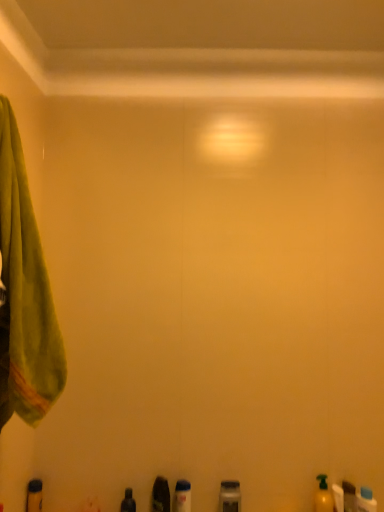
What do you see at coordinates (182, 496) in the screenshot? I see `translucent plastic bottle at lower center, which is the sixth toiletry from right to left` at bounding box center [182, 496].

What is the approximate width of translucent plastic bottle at lower center, which is the third toiletry from left to right?

translucent plastic bottle at lower center, which is the third toiletry from left to right, is 2.88 inches in width.

In order to click on yellow matte bottle at lower right, which appears as the 3th toiletry when viewed from the right in this screenshot , I will do `click(338, 497)`.

The height and width of the screenshot is (512, 384). I want to click on translucent plastic bottle at lower center, which is the third toiletry from left to right, so click(182, 496).

Considering the positions of objects matte black bottle at lower left, the first toiletry positioned from the left, and shiny black bottle at lower center, the 2th toiletry from the left, in the image provided, who is more to the left, matte black bottle at lower left, the first toiletry positioned from the left, or shiny black bottle at lower center, the 2th toiletry from the left,?

From the viewer's perspective, matte black bottle at lower left, the first toiletry positioned from the left, appears more on the left side.

Who is smaller, matte black bottle at lower left, the first toiletry positioned from the left, or shiny black bottle at lower center, the 7th toiletry when ordered from right to left?

With smaller size is shiny black bottle at lower center, the 7th toiletry when ordered from right to left.

What's the angular difference between matte black bottle at lower left, the first toiletry positioned from the left, and shiny black bottle at lower center, the 7th toiletry when ordered from right to left,'s facing directions?

They differ by 0.000881 degrees in their facing directions.

Can yellow matte bottle at lower right, marked as the 6th toiletry in a left-to-right arrangement, be found inside shiny black bottle at lower center, the 7th toiletry when ordered from right to left?

Actually, yellow matte bottle at lower right, marked as the 6th toiletry in a left-to-right arrangement, is outside shiny black bottle at lower center, the 7th toiletry when ordered from right to left.

Between shiny black bottle at lower center, the 7th toiletry when ordered from right to left, and yellow matte bottle at lower right, which appears as the 3th toiletry when viewed from the right, which one has larger width?

With larger width is yellow matte bottle at lower right, which appears as the 3th toiletry when viewed from the right.

Is shiny black bottle at lower center, the 2th toiletry from the left, next to yellow matte bottle at lower right, marked as the 6th toiletry in a left-to-right arrangement?

shiny black bottle at lower center, the 2th toiletry from the left, and yellow matte bottle at lower right, marked as the 6th toiletry in a left-to-right arrangement, are clearly separated.

In terms of size, does shiny black bottle at lower center, the 7th toiletry when ordered from right to left, appear bigger or smaller than yellow matte bottle at lower right, marked as the 6th toiletry in a left-to-right arrangement?

Considering their sizes, shiny black bottle at lower center, the 7th toiletry when ordered from right to left, takes up more space than yellow matte bottle at lower right, marked as the 6th toiletry in a left-to-right arrangement.

From a real-world perspective, relative to green soft towel at left, is metallic gray container at lower center, arranged as the fourth toiletry when viewed from the left, vertically above or below?

metallic gray container at lower center, arranged as the fourth toiletry when viewed from the left, is situated lower than green soft towel at left in the real world.

In the scene shown: Which object is thinner, metallic gray container at lower center, arranged as the fourth toiletry when viewed from the left, or green soft towel at left?

Thinner between the two is metallic gray container at lower center, arranged as the fourth toiletry when viewed from the left.

From the image's perspective, is metallic gray container at lower center, the 5th toiletry in the right-to-left sequence, beneath green soft towel at left?

Yes.

Considering the relative sizes of metallic gray container at lower center, the 5th toiletry in the right-to-left sequence, and green soft towel at left in the image provided, is metallic gray container at lower center, the 5th toiletry in the right-to-left sequence, smaller than green soft towel at left?

Indeed, metallic gray container at lower center, the 5th toiletry in the right-to-left sequence, has a smaller size compared to green soft towel at left.

Does point (224, 495) come farther from viewer compared to point (351, 494)?

No.

Consider the image. Is translucent plastic bottle at lower right, which is the second toiletry from right to left, completely or partially inside metallic gray container at lower center, arranged as the fourth toiletry when viewed from the left?

No, translucent plastic bottle at lower right, which is the second toiletry from right to left, is not surrounded by metallic gray container at lower center, arranged as the fourth toiletry when viewed from the left.

Measure the distance from metallic gray container at lower center, the 5th toiletry in the right-to-left sequence, to translucent plastic bottle at lower right, arranged as the 7th toiletry when viewed from the left.

The distance of metallic gray container at lower center, the 5th toiletry in the right-to-left sequence, from translucent plastic bottle at lower right, arranged as the 7th toiletry when viewed from the left, is 16.17 inches.

From the picture: Who is smaller, metallic gray container at lower center, arranged as the fourth toiletry when viewed from the left, or translucent plastic bottle at lower right, which is the second toiletry from right to left?

With smaller size is translucent plastic bottle at lower right, which is the second toiletry from right to left.

Is green soft towel at left placed right next to metallic gray container at lower center, the 5th toiletry in the right-to-left sequence?

green soft towel at left and metallic gray container at lower center, the 5th toiletry in the right-to-left sequence, are not in contact.

Is green soft towel at left to the right of metallic gray container at lower center, arranged as the fourth toiletry when viewed from the left, from the viewer's perspective?

No, green soft towel at left is not to the right of metallic gray container at lower center, arranged as the fourth toiletry when viewed from the left.

Is green soft towel at left bigger than metallic gray container at lower center, arranged as the fourth toiletry when viewed from the left?

Yes, green soft towel at left is bigger than metallic gray container at lower center, arranged as the fourth toiletry when viewed from the left.

Between yellow matte bottle at lower right, the 4th toiletry when ordered from right to left, and shiny black bottle at lower center, the 2th toiletry from the left, which one is positioned in front?

yellow matte bottle at lower right, the 4th toiletry when ordered from right to left, is in front.

Which of these two, yellow matte bottle at lower right, the fifth toiletry in the left-to-right sequence, or shiny black bottle at lower center, the 7th toiletry when ordered from right to left, is thinner?

Thinner between the two is shiny black bottle at lower center, the 7th toiletry when ordered from right to left.

In the scene shown: From the image's perspective, is yellow matte bottle at lower right, the fifth toiletry in the left-to-right sequence, below shiny black bottle at lower center, the 2th toiletry from the left?

Actually, yellow matte bottle at lower right, the fifth toiletry in the left-to-right sequence, appears above shiny black bottle at lower center, the 2th toiletry from the left, in the image.

Is metallic gray container at lower center, arranged as the fourth toiletry when viewed from the left, turned away from blue plastic bottle at lower right, placed as the first toiletry when sorted from right to left?

No, blue plastic bottle at lower right, placed as the first toiletry when sorted from right to left, is not at the back of metallic gray container at lower center, arranged as the fourth toiletry when viewed from the left.

In the scene shown: Considering the relative positions of metallic gray container at lower center, the 5th toiletry in the right-to-left sequence, and blue plastic bottle at lower right, placed as the first toiletry when sorted from right to left, in the image provided, is metallic gray container at lower center, the 5th toiletry in the right-to-left sequence, to the left of blue plastic bottle at lower right, placed as the first toiletry when sorted from right to left, from the viewer's perspective?

Correct, you'll find metallic gray container at lower center, the 5th toiletry in the right-to-left sequence, to the left of blue plastic bottle at lower right, placed as the first toiletry when sorted from right to left.

How different are the orientations of metallic gray container at lower center, arranged as the fourth toiletry when viewed from the left, and blue plastic bottle at lower right, placed as the eighth toiletry when sorted from left to right, in degrees?

34.6 degrees separate the facing orientations of metallic gray container at lower center, arranged as the fourth toiletry when viewed from the left, and blue plastic bottle at lower right, placed as the eighth toiletry when sorted from left to right.

From a real-world perspective, is metallic gray container at lower center, the 5th toiletry in the right-to-left sequence, physically located above or below blue plastic bottle at lower right, placed as the eighth toiletry when sorted from left to right?

metallic gray container at lower center, the 5th toiletry in the right-to-left sequence, is situated higher than blue plastic bottle at lower right, placed as the eighth toiletry when sorted from left to right, in the real world.

Which toiletry is the 1st one when counting from the right side of the matte black bottle at lower left, the first toiletry positioned from the left? Please provide its 2D coordinates.

[(128, 502)]

Identify the location of toiletry that is the 2nd object located below the shiny black bottle at lower center, the 7th toiletry when ordered from right to left (from the image's perspective). This screenshot has width=384, height=512. (338, 497).

From the image, which object appears to be nearer to shiny black bottle at lower center, the 2th toiletry from the left, translucent plastic bottle at lower right, which is the second toiletry from right to left, or blue plastic bottle at lower right, placed as the eighth toiletry when sorted from left to right?

translucent plastic bottle at lower right, which is the second toiletry from right to left, is closer to shiny black bottle at lower center, the 2th toiletry from the left.

Based on their spatial positions, is yellow matte bottle at lower right, which appears as the 3th toiletry when viewed from the right, or yellow matte bottle at lower right, the fifth toiletry in the left-to-right sequence, closer to shiny black bottle at lower center, the 7th toiletry when ordered from right to left?

yellow matte bottle at lower right, the fifth toiletry in the left-to-right sequence, is closer to shiny black bottle at lower center, the 7th toiletry when ordered from right to left.

Based on their spatial positions, is green soft towel at left or translucent plastic bottle at lower right, arranged as the 7th toiletry when viewed from the left, further from shiny black bottle at lower center, the 7th toiletry when ordered from right to left?

Among the two, green soft towel at left is located further to shiny black bottle at lower center, the 7th toiletry when ordered from right to left.

Which object lies further to the anchor point green soft towel at left, metallic gray container at lower center, arranged as the fourth toiletry when viewed from the left, or yellow matte bottle at lower right, the 4th toiletry when ordered from right to left?

yellow matte bottle at lower right, the 4th toiletry when ordered from right to left, is positioned further to the anchor green soft towel at left.

Which object lies further to the anchor point yellow matte bottle at lower right, which appears as the 3th toiletry when viewed from the right, translucent plastic bottle at lower center, which is the third toiletry from left to right, or metallic gray container at lower center, arranged as the fourth toiletry when viewed from the left?

translucent plastic bottle at lower center, which is the third toiletry from left to right.

From the image, which object appears to be farther from blue plastic bottle at lower right, placed as the eighth toiletry when sorted from left to right, yellow matte bottle at lower right, which appears as the 3th toiletry when viewed from the right, or matte black bottle at lower left, the first toiletry positioned from the left?

Based on the image, matte black bottle at lower left, the first toiletry positioned from the left, appears to be further to blue plastic bottle at lower right, placed as the eighth toiletry when sorted from left to right.

When comparing their distances from yellow matte bottle at lower right, marked as the 6th toiletry in a left-to-right arrangement, does green soft towel at left or shiny black bottle at lower center, the 7th toiletry when ordered from right to left, seem further?

Based on the image, green soft towel at left appears to be further to yellow matte bottle at lower right, marked as the 6th toiletry in a left-to-right arrangement.

When comparing their distances from translucent plastic bottle at lower right, arranged as the 7th toiletry when viewed from the left, does metallic gray container at lower center, arranged as the fourth toiletry when viewed from the left, or blue plastic bottle at lower right, placed as the first toiletry when sorted from right to left, seem further?

The object further to translucent plastic bottle at lower right, arranged as the 7th toiletry when viewed from the left, is metallic gray container at lower center, arranged as the fourth toiletry when viewed from the left.

Identify the location of toiletry situated between shiny black bottle at lower center, the 2th toiletry from the left, and metallic gray container at lower center, arranged as the fourth toiletry when viewed from the left, from left to right. The image size is (384, 512). (182, 496).

Where is `toiletry situated between yellow matte bottle at lower right, the 4th toiletry when ordered from right to left, and translucent plastic bottle at lower right, which is the second toiletry from right to left, from left to right`? The width and height of the screenshot is (384, 512). toiletry situated between yellow matte bottle at lower right, the 4th toiletry when ordered from right to left, and translucent plastic bottle at lower right, which is the second toiletry from right to left, from left to right is located at coordinates (338, 497).

Where is `toiletry between matte black bottle at lower left, arranged as the eighth toiletry when viewed from the right, and translucent plastic bottle at lower center, which is the sixth toiletry from right to left, in the horizontal direction`? toiletry between matte black bottle at lower left, arranged as the eighth toiletry when viewed from the right, and translucent plastic bottle at lower center, which is the sixth toiletry from right to left, in the horizontal direction is located at coordinates (128, 502).

The height and width of the screenshot is (512, 384). Find the location of `toiletry between metallic gray container at lower center, the 5th toiletry in the right-to-left sequence, and yellow matte bottle at lower right, marked as the 6th toiletry in a left-to-right arrangement`. toiletry between metallic gray container at lower center, the 5th toiletry in the right-to-left sequence, and yellow matte bottle at lower right, marked as the 6th toiletry in a left-to-right arrangement is located at coordinates (323, 496).